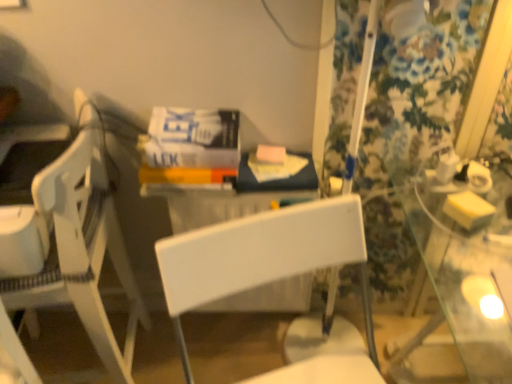
Question: Is white plastic chair at center, placed as the 1th chair when sorted from right to left, inside white plastic chair at left, which is the second chair in right-to-left order?

Choices:
 (A) yes
 (B) no

Answer: (B)

Question: Is white plastic chair at left, which is the second chair in right-to-left order, facing away from white plastic chair at center, placed as the 1th chair when sorted from right to left?

Choices:
 (A) no
 (B) yes

Answer: (A)

Question: Is white plastic chair at left, the 1th chair from the left, directly adjacent to white plastic chair at center, placed as the 1th chair when sorted from right to left?

Choices:
 (A) yes
 (B) no

Answer: (B)

Question: From the image's perspective, would you say white plastic chair at left, the 1th chair from the left, is positioned over white plastic chair at center, the 2th chair viewed from the left?

Choices:
 (A) yes
 (B) no

Answer: (A)

Question: Is the position of white plastic chair at left, the 1th chair from the left, more distant than that of white plastic chair at center, placed as the 1th chair when sorted from right to left?

Choices:
 (A) yes
 (B) no

Answer: (A)

Question: From a real-world perspective, is white plastic chair at left, which is the second chair in right-to-left order, physically above white plastic chair at center, the 2th chair viewed from the left?

Choices:
 (A) yes
 (B) no

Answer: (A)

Question: Does floral fabric curtain at right have a greater height compared to white plastic chair at center, placed as the 1th chair when sorted from right to left?

Choices:
 (A) no
 (B) yes

Answer: (B)

Question: From the image's perspective, would you say floral fabric curtain at right is positioned over white plastic chair at center, the 2th chair viewed from the left?

Choices:
 (A) yes
 (B) no

Answer: (A)

Question: Is floral fabric curtain at right wider than white plastic chair at center, placed as the 1th chair when sorted from right to left?

Choices:
 (A) yes
 (B) no

Answer: (B)

Question: Does floral fabric curtain at right have a larger size compared to white plastic chair at center, the 2th chair viewed from the left?

Choices:
 (A) no
 (B) yes

Answer: (A)

Question: Is floral fabric curtain at right smaller than white plastic chair at center, placed as the 1th chair when sorted from right to left?

Choices:
 (A) no
 (B) yes

Answer: (B)

Question: Does floral fabric curtain at right appear on the right side of white plastic chair at center, placed as the 1th chair when sorted from right to left?

Choices:
 (A) yes
 (B) no

Answer: (A)

Question: Is floral fabric curtain at right thinner than white plastic chair at left, the 1th chair from the left?

Choices:
 (A) no
 (B) yes

Answer: (B)